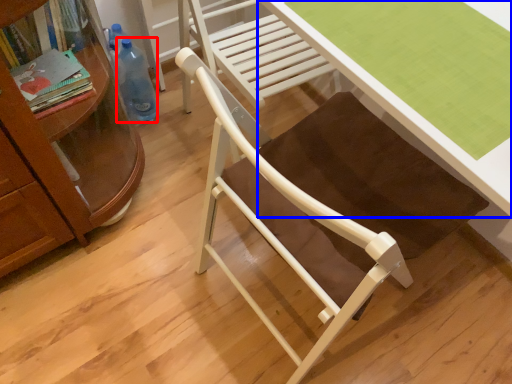
Question: Among these objects, which one is nearest to the camera, bottle (highlighted by a red box) or desk (highlighted by a blue box)?

Choices:
 (A) bottle
 (B) desk

Answer: (B)